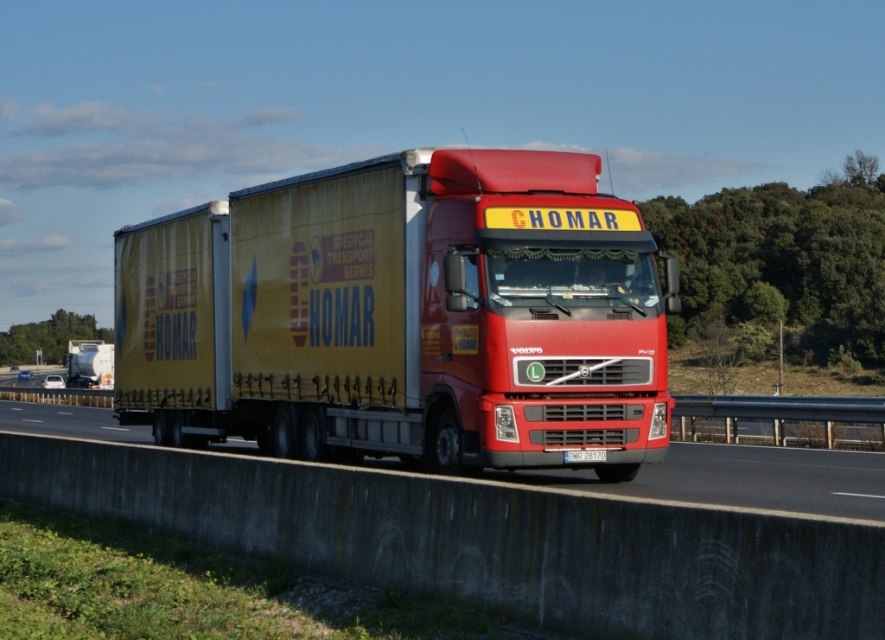
Question: Which of the following is the farthest from the observer?

Choices:
 (A) white plastic license plate at center
 (B) matte yellow trailer truck at center
 (C) red matte truck at center
 (D) matte yellow trailer at center

Answer: (D)

Question: Does matte yellow trailer at center lie in front of white plastic license plate at center?

Choices:
 (A) no
 (B) yes

Answer: (A)

Question: Which point is farther to the camera?

Choices:
 (A) (372, 216)
 (B) (579, 458)

Answer: (A)

Question: Which point is farther to the camera?

Choices:
 (A) (448, 268)
 (B) (685, 483)
 (C) (66, 381)
 (D) (582, 460)

Answer: (C)

Question: Can you confirm if red matte truck at center is thinner than matte yellow trailer at center?

Choices:
 (A) no
 (B) yes

Answer: (A)

Question: Is matte yellow trailer at center bigger than white plastic license plate at center?

Choices:
 (A) yes
 (B) no

Answer: (A)